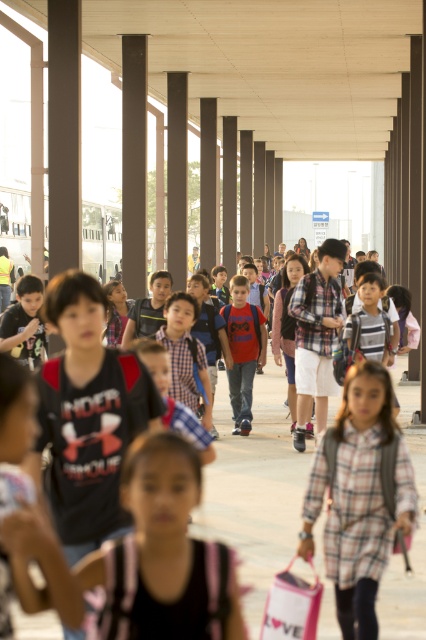
Question: Which point appears closest to the camera in this image?

Choices:
 (A) (20, 328)
 (B) (262, 321)
 (C) (308, 524)

Answer: (C)

Question: From the image, what is the correct spatial relationship of plaid shirt at center in relation to matte black backpack at center?

Choices:
 (A) above
 (B) below

Answer: (B)

Question: Which point appears farthest from the camera in this image?

Choices:
 (A) (250, 305)
 (B) (351, 451)

Answer: (A)

Question: Which point is closer to the camera?

Choices:
 (A) matte black backpack at center
 (B) matte red shirt at center
 (C) plaid shirt at center

Answer: (C)

Question: Is plaid shirt at center above matte red shirt at center?

Choices:
 (A) no
 (B) yes

Answer: (A)

Question: Does plaid shirt at center appear under matte black backpack at center?

Choices:
 (A) yes
 (B) no

Answer: (A)